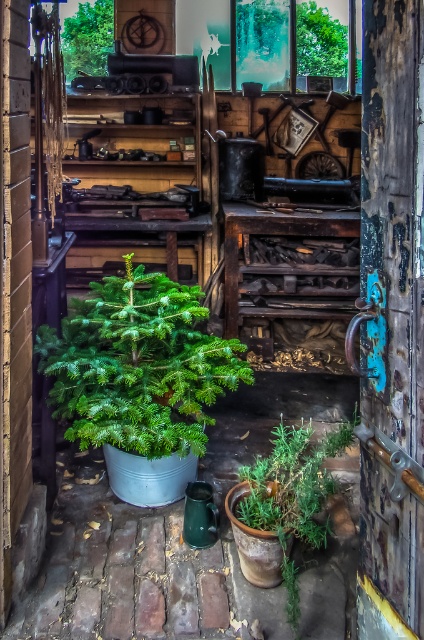
Question: Which point is closer to the camera taking this photo?

Choices:
 (A) click(x=69, y=67)
 (B) click(x=270, y=496)
 (C) click(x=370, y=387)

Answer: (C)

Question: Can you confirm if green matte potted plant at center is positioned to the right of green leafy plant at lower center?

Choices:
 (A) yes
 (B) no

Answer: (B)

Question: Estimate the real-world distances between objects in this image. Which object is farther from the green matte tree at upper center?

Choices:
 (A) green leafy plant at lower center
 (B) rusty wooden door at right

Answer: (B)

Question: Does green leafy plant at lower center appear on the right side of green matte tree at upper center?

Choices:
 (A) yes
 (B) no

Answer: (A)

Question: Which point is closer to the camera?

Choices:
 (A) (265, 476)
 (B) (376, 349)
 (C) (117, 416)

Answer: (B)

Question: Considering the relative positions of rusty wooden door at right and green matte potted plant at center in the image provided, where is rusty wooden door at right located with respect to green matte potted plant at center?

Choices:
 (A) above
 (B) below

Answer: (A)